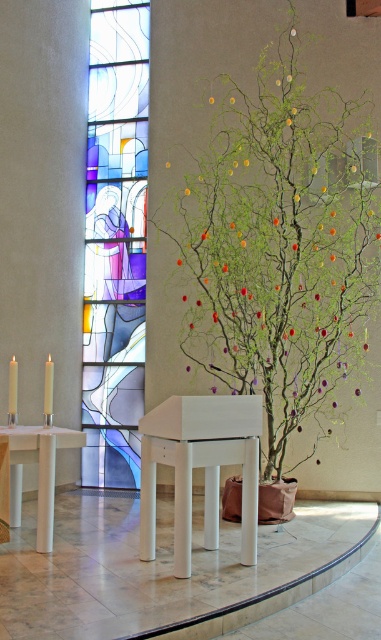
Question: Which point appears closest to the camera in this image?

Choices:
 (A) (49, 376)
 (B) (9, 460)
 (C) (342, 353)
 (D) (11, 368)

Answer: (B)

Question: Does white glossy table at center have a lesser width compared to yellow wax candle at left?

Choices:
 (A) no
 (B) yes

Answer: (A)

Question: Does green matte tree at center appear on the left side of stained glass window at center?

Choices:
 (A) no
 (B) yes

Answer: (A)

Question: Among these objects, which one is nearest to the camera?

Choices:
 (A) white glossy table at center
 (B) green matte tree at center
 (C) yellow wax candle at left
 (D) stained glass window at center

Answer: (A)

Question: Does green matte tree at center have a smaller size compared to white glossy table at lower left?

Choices:
 (A) no
 (B) yes

Answer: (A)

Question: Which point is farther to the camera?

Choices:
 (A) (240, 38)
 (B) (49, 369)
 (C) (14, 387)

Answer: (A)